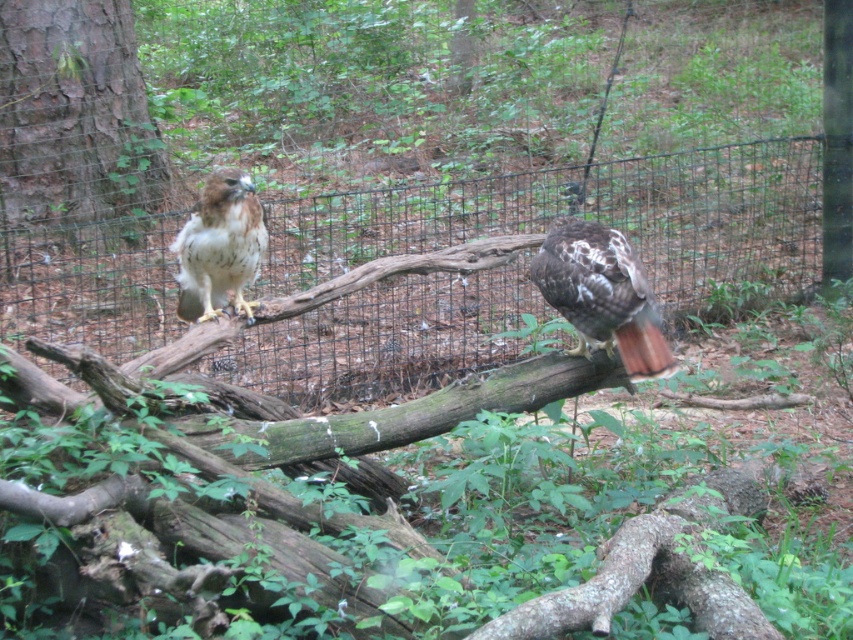
Who is more forward, (22,170) or (560,248)?

Positioned in front is point (560,248).

Between brown rough bark tree at left and brown speckled feathers at center, which one has more height?

Standing taller between the two is brown rough bark tree at left.

Where is `brown rough bark tree at left`? Image resolution: width=853 pixels, height=640 pixels. brown rough bark tree at left is located at coordinates (74, 115).

The height and width of the screenshot is (640, 853). I want to click on brown rough bark tree at left, so click(74, 115).

Does brown speckled feathers at center appear under brown speckled feathers at left?

Indeed, brown speckled feathers at center is positioned under brown speckled feathers at left.

Is brown speckled feathers at center taller than brown speckled feathers at left?

Yes, brown speckled feathers at center is taller than brown speckled feathers at left.

Which is behind, point (595, 312) or point (227, 262)?

Positioned behind is point (227, 262).

The image size is (853, 640). In order to click on brown speckled feathers at center in this screenshot , I will do `click(602, 294)`.

From the picture: Is black wire mesh at center thinner than brown speckled feathers at center?

In fact, black wire mesh at center might be wider than brown speckled feathers at center.

At what (x,y) coordinates should I click in order to perform the action: click on black wire mesh at center. Please return your answer as a coordinate pair (x, y). Image resolution: width=853 pixels, height=640 pixels. Looking at the image, I should click on (717, 216).

I want to click on black wire mesh at center, so click(717, 216).